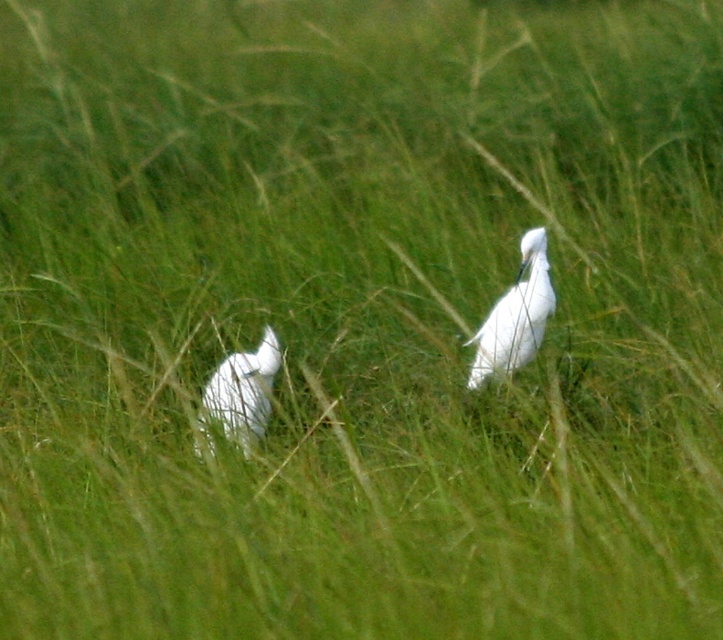
Question: Which object is closer to the camera taking this photo?

Choices:
 (A) white smooth bird at center
 (B) white feathered bird at center

Answer: (B)

Question: Does white smooth bird at center have a smaller size compared to white feathered bird at center?

Choices:
 (A) no
 (B) yes

Answer: (A)

Question: Can you confirm if white smooth bird at center is bigger than white feathered bird at center?

Choices:
 (A) no
 (B) yes

Answer: (B)

Question: Is white smooth bird at center to the left of white feathered bird at center from the viewer's perspective?

Choices:
 (A) yes
 (B) no

Answer: (B)

Question: Which of the following is the farthest from the observer?

Choices:
 (A) (484, 380)
 (B) (257, 392)

Answer: (A)